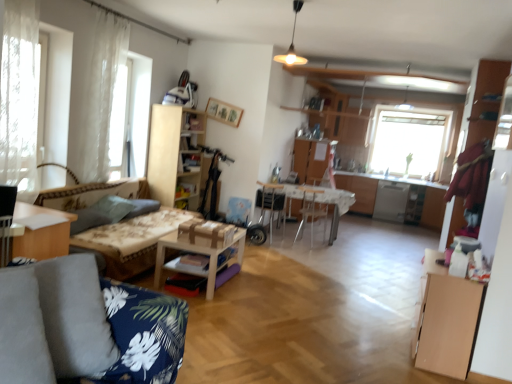
Question: From a real-world perspective, relative to satin silver dishwasher at right, is floral fabric couch at left vertically above or below?

Choices:
 (A) above
 (B) below

Answer: (B)

Question: Is floral fabric couch at left situated inside satin silver dishwasher at right or outside?

Choices:
 (A) outside
 (B) inside

Answer: (A)

Question: Estimate the real-world distances between objects in this image. Which object is closer to the wooden armchair at center, which is the second armchair from right to left?

Choices:
 (A) floral fabric couch at left
 (B) white sheer curtain at left
 (C) satin silver dishwasher at right
 (D) dark blue floral fabric couch at lower left
 (E) wooden table at center, the 2th table positioned from the front

Answer: (A)

Question: Based on their relative distances, which object is nearer to the dark blue floral fabric couch at lower left?

Choices:
 (A) light wood cabinet at center, the first cabinetry positioned from the left
 (B) white sheer curtain at left, which appears as the 2th window when viewed from the front
 (C) wooden shelf at center
 (D) wooden armchair at center, the first armchair positioned from the left
 (E) light brown wooden table at lower left, the third table from the back

Answer: (E)